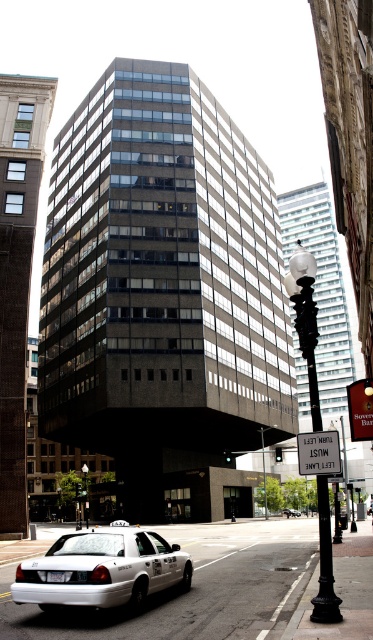
You are a pedestrian standing on the sidewalk looking at the modern building. You see the black wrought iron streetlamp at center right and the white plastic sign at center. Which object is located to the right of the other?

The black wrought iron streetlamp at center right is positioned on the right side of white plastic sign at center, so the streetlamp is to the right of the sign.

Looking at this image, you are a delivery person trying to park your delivery van, which is 2 meters wide, in the space between the white glossy taxi at lower left and the black wrought iron streetlamp at center right. Can your van fit in that space?

The white glossy taxi at lower left has a lesser width compared to the black wrought iron streetlamp at center right. Since the van is 2 meters wide, but the space between them is narrower than the streetlamp, it might not fit. However, the exact width isn

You are a city planner assessing the street layout. You need to install a new traffic light pole that is 1.2 meters wide. The current street has the black wrought iron streetlamp at center right and the white plastic sign at center. Which existing object can accommodate the new pole without blocking the sign or the lamp?

The black wrought iron streetlamp at center right has a width surpassing the white plastic sign at center, so the traffic light pole can be placed next to the black wrought iron streetlamp at center right since it is wider and less likely to block the sign.